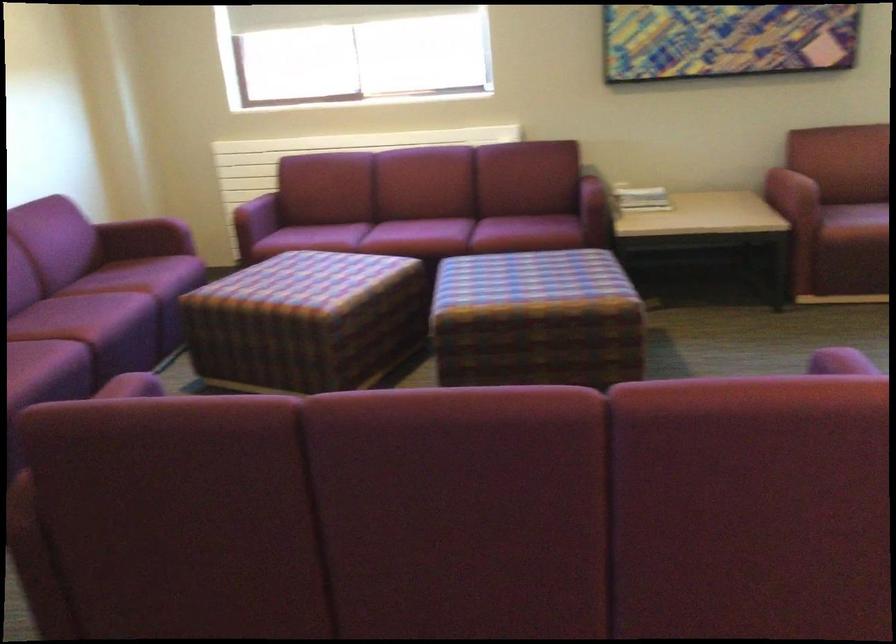
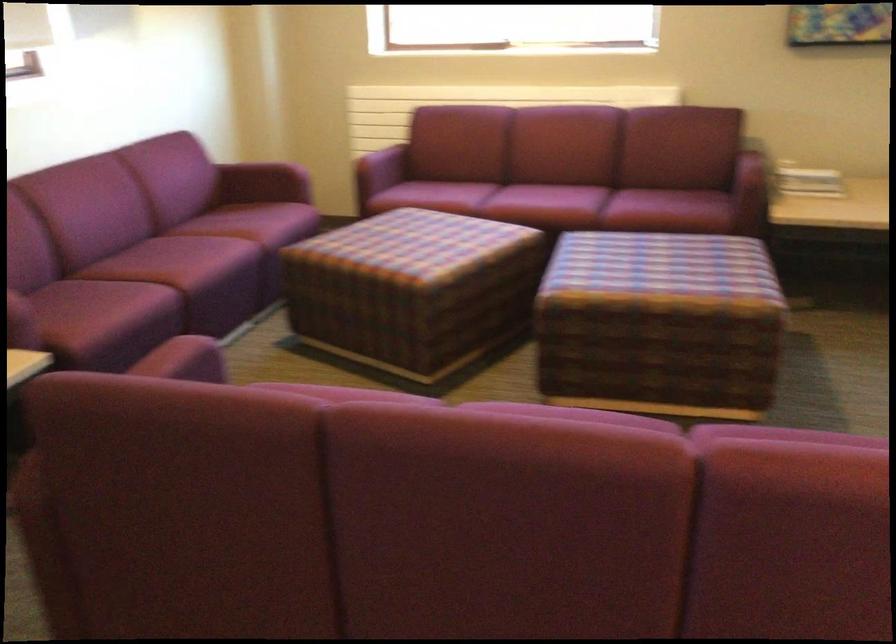
Find the pixel in the second image that matches point (598, 198) in the first image.

(753, 180)